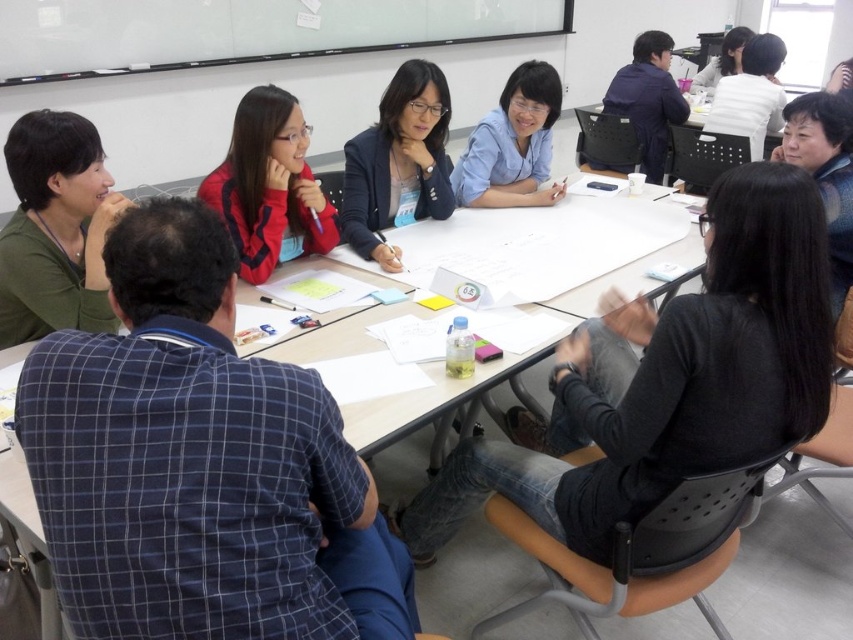
You are standing at the entrance of the classroom and notice a person wearing a black matte shirt at center. Can you determine the exact coordinates of where this person is sitting relative to the classroom entrance?

The black matte shirt at center is located at point (668,380), so the person is sitting at those coordinates relative to the classroom entrance.